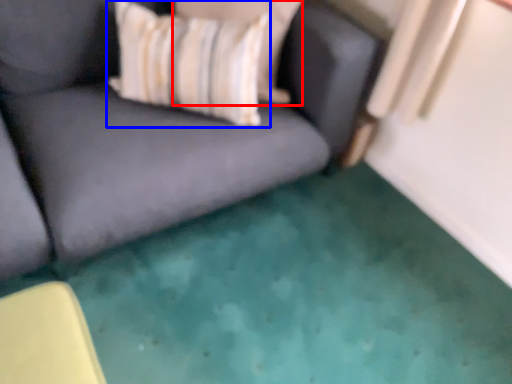
Question: Among these objects, which one is nearest to the camera, pillow (highlighted by a red box) or throw pillow (highlighted by a blue box)?

Choices:
 (A) pillow
 (B) throw pillow

Answer: (B)